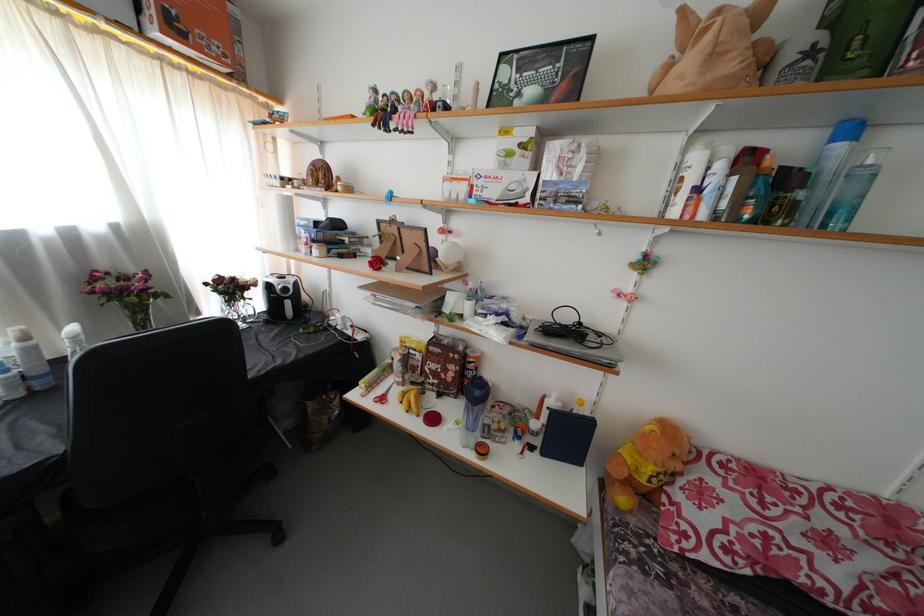
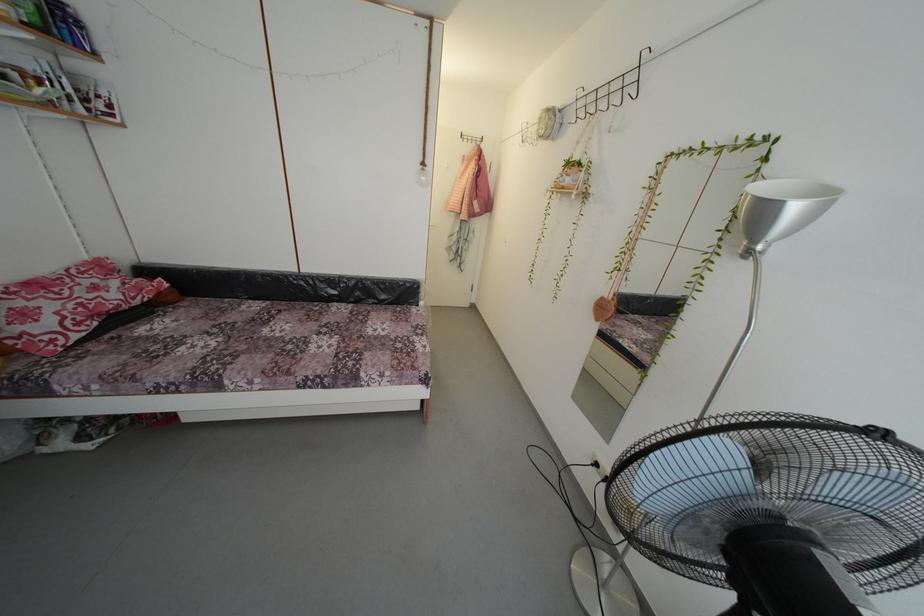
The point at [732,492] is marked in the first image. Where is the corresponding point in the second image?

(34, 306)